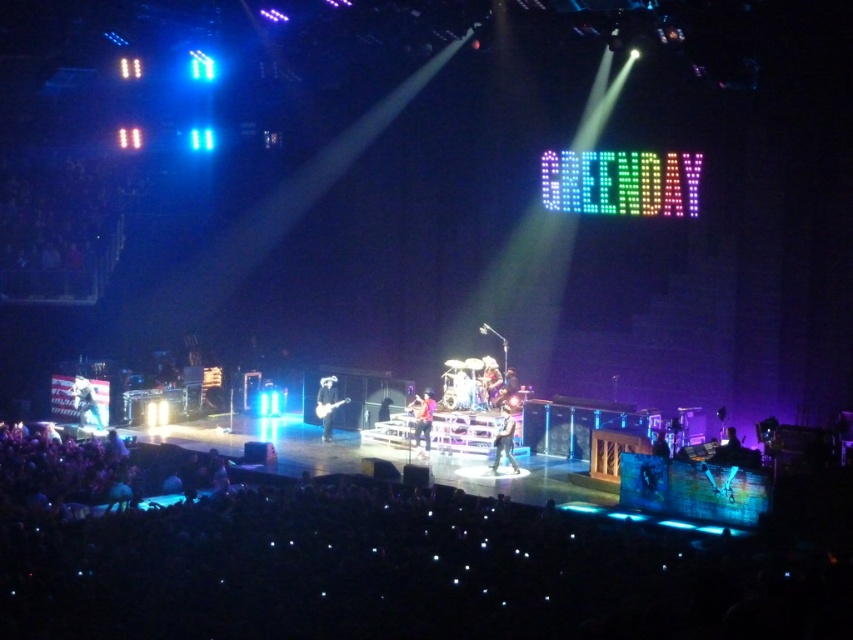
You are a photographer at the concert and want to capture both the drummer and the guitarist in the same frame. The drummer is at point [322,397] and the guitarist is at point [432,413]. Which musician will appear closer to the camera in your photo?

The drummer at point [322,397] will appear closer to the camera because the point is further to the camera than point [432,413] where the guitarist is located.

You are a stagehand at a concert venue and need to place a new speaker system. The stage layout shows a black fabric crowd at lower center. Where exactly should you position the speaker system to avoid blocking the audience? Please provide coordinates in the format of point followed by numbers.

The speaker system should be placed away from the black fabric crowd at lower center, which is located at point (x=392, y=564). Positioning it elsewhere would prevent obstruction of the audience.